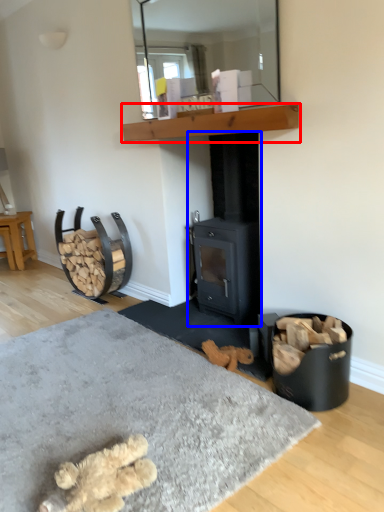
Question: Among these objects, which one is farthest to the camera, shelf (highlighted by a red box) or wood burning stove (highlighted by a blue box)?

Choices:
 (A) shelf
 (B) wood burning stove

Answer: (B)